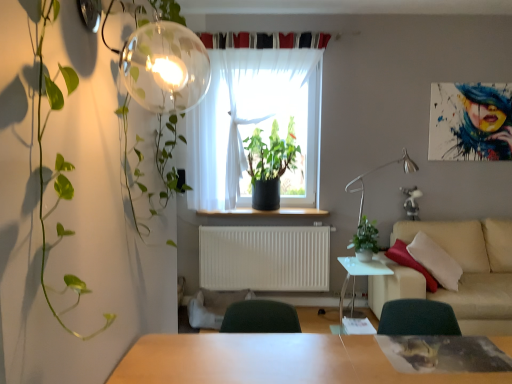
Question: Is white glossy side table at center taller than green matte plant at center, which appears as the 2th houseplant when ordered from the bottom?

Choices:
 (A) no
 (B) yes

Answer: (A)

Question: Is white glossy side table at center further to the viewer compared to green matte plant at center, which appears as the 2th houseplant when ordered from the bottom?

Choices:
 (A) yes
 (B) no

Answer: (B)

Question: From the image's perspective, is white glossy side table at center above green matte plant at center, which ranks as the 1th houseplant in left-to-right order?

Choices:
 (A) no
 (B) yes

Answer: (A)

Question: Does white glossy side table at center appear on the right side of green matte plant at center, which ranks as the 1th houseplant in back-to-front order?

Choices:
 (A) no
 (B) yes

Answer: (B)

Question: Does white glossy side table at center have a greater width compared to green matte plant at center, which appears as the 2th houseplant when ordered from the bottom?

Choices:
 (A) no
 (B) yes

Answer: (B)

Question: Is white glossy side table at center not near green matte plant at center, which ranks as the 1th houseplant in left-to-right order?

Choices:
 (A) no
 (B) yes

Answer: (B)

Question: Is green matte plant at center, the 2th houseplant positioned from the back, thinner than white matte radiator at center?

Choices:
 (A) no
 (B) yes

Answer: (A)

Question: Is green matte plant at center, positioned as the second houseplant in top-to-bottom order, smaller than white matte radiator at center?

Choices:
 (A) no
 (B) yes

Answer: (B)

Question: From a real-world perspective, is green matte plant at center, positioned as the second houseplant in top-to-bottom order, under white matte radiator at center?

Choices:
 (A) no
 (B) yes

Answer: (A)

Question: From the image's perspective, would you say green matte plant at center, positioned as the first houseplant in bottom-to-top order, is shown under white matte radiator at center?

Choices:
 (A) yes
 (B) no

Answer: (B)

Question: Considering the relative positions of green matte plant at center, which is the 1th houseplant in front-to-back order, and white matte radiator at center in the image provided, is green matte plant at center, which is the 1th houseplant in front-to-back order, to the right of white matte radiator at center from the viewer's perspective?

Choices:
 (A) yes
 (B) no

Answer: (A)

Question: Is green matte plant at center, the 2th houseplant positioned from the back, next to white matte radiator at center and touching it?

Choices:
 (A) no
 (B) yes

Answer: (A)

Question: Does green matte plant at center, which appears as the 2th houseplant when ordered from the bottom, come in front of white sheer curtain at center?

Choices:
 (A) yes
 (B) no

Answer: (B)